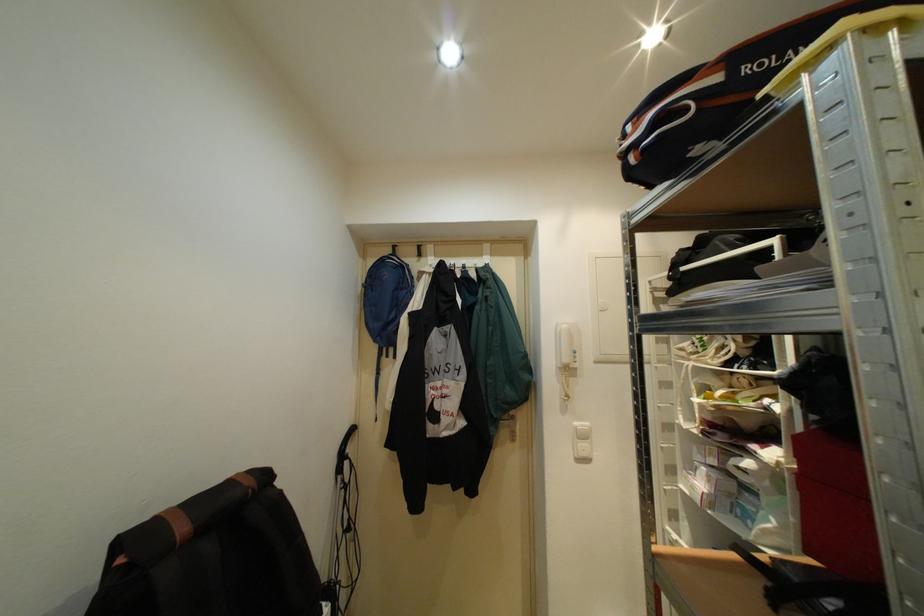
The image size is (924, 616). What do you see at coordinates (565, 346) in the screenshot?
I see `a white intercom handset` at bounding box center [565, 346].